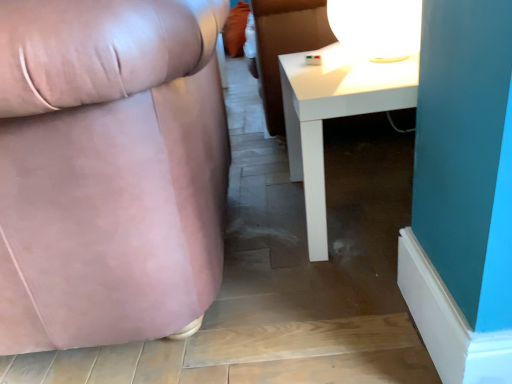
What do you see at coordinates (109, 170) in the screenshot? The image size is (512, 384). I see `matte pink fabric chair at left` at bounding box center [109, 170].

You are a GUI agent. You are given a task and a screenshot of the screen. Output one action in this format:
    pyautogui.click(x=<x>, y=<y>)
    Task: Click on the matte pink fabric chair at left
    The height and width of the screenshot is (384, 512).
    Given the screenshot: What is the action you would take?
    pyautogui.click(x=109, y=170)

How many degrees apart are the facing directions of matte pink fabric chair at left and white glossy table lamp at upper right?

The facing directions of matte pink fabric chair at left and white glossy table lamp at upper right are 88.9 degrees apart.

Would you say matte pink fabric chair at left is outside white glossy table lamp at upper right?

Yes, matte pink fabric chair at left is located beyond the bounds of white glossy table lamp at upper right.

Which is less distant, (196, 205) or (367, 50)?

Point (196, 205) is closer to the camera than point (367, 50).

Which object is more forward, matte pink fabric chair at left or white glossy table lamp at upper right?

Positioned in front is matte pink fabric chair at left.

From the picture: Is white glossy table at lower right wider than white glossy table lamp at upper right?

Indeed, white glossy table at lower right has a greater width compared to white glossy table lamp at upper right.

From the image's perspective, would you say white glossy table at lower right is shown under white glossy table lamp at upper right?

Yes.

From a real-world perspective, who is located higher, white glossy table at lower right or white glossy table lamp at upper right?

white glossy table lamp at upper right.

Is white glossy table lamp at upper right not close to matte pink fabric chair at left?

They are positioned close to each other.

From a real-world perspective, is white glossy table lamp at upper right on matte pink fabric chair at left?

Yes, from a real-world perspective, white glossy table lamp at upper right is above matte pink fabric chair at left.

Which of these two, white glossy table lamp at upper right or matte pink fabric chair at left, stands shorter?

Standing shorter between the two is white glossy table lamp at upper right.

Do you think white glossy table lamp at upper right is within matte pink fabric chair at left, or outside of it?

white glossy table lamp at upper right is spatially situated outside matte pink fabric chair at left.

What's the angular difference between matte pink fabric chair at left and white glossy table at lower right's facing directions?

The angular difference between matte pink fabric chair at left and white glossy table at lower right is 179 degrees.

Considering the relative sizes of matte pink fabric chair at left and white glossy table at lower right in the image provided, is matte pink fabric chair at left taller than white glossy table at lower right?

Correct, matte pink fabric chair at left is much taller as white glossy table at lower right.

Relative to white glossy table at lower right, is matte pink fabric chair at left in front or behind?

In the image, matte pink fabric chair at left appears in front of white glossy table at lower right.

Is matte pink fabric chair at left inside the boundaries of white glossy table at lower right, or outside?

matte pink fabric chair at left exists outside the volume of white glossy table at lower right.

From a real-world perspective, between white glossy table lamp at upper right and white glossy table at lower right, who is vertically higher?

In real-world perspective, white glossy table lamp at upper right is above.

Locate an element on the screen. This screenshot has height=384, width=512. table below the white glossy table lamp at upper right (from the image's perspective) is located at coordinates (334, 115).

Does white glossy table lamp at upper right appear on the right side of white glossy table at lower right?

No, white glossy table lamp at upper right is not to the right of white glossy table at lower right.

Does white glossy table at lower right have a greater height compared to matte pink fabric chair at left?

Incorrect, the height of white glossy table at lower right is not larger of that of matte pink fabric chair at left.

Is the depth of white glossy table at lower right greater than that of matte pink fabric chair at left?

That is True.

Considering the relative positions of white glossy table at lower right and matte pink fabric chair at left in the image provided, is white glossy table at lower right to the right of matte pink fabric chair at left from the viewer's perspective?

Yes, white glossy table at lower right is to the right of matte pink fabric chair at left.

At what (x,y) coordinates should I click in order to perform the action: click on chair on the left of white glossy table lamp at upper right. Please return your answer as a coordinate pair (x, y). Looking at the image, I should click on (109, 170).

Identify the location of table lamp located behind the white glossy table at lower right. (377, 27).

When comparing their distances from white glossy table lamp at upper right, does matte pink fabric chair at left or white glossy table at lower right seem further?

Among the two, matte pink fabric chair at left is located further to white glossy table lamp at upper right.

Looking at the image, which one is located further to white glossy table lamp at upper right, white glossy table at lower right or matte pink fabric chair at left?

The object further to white glossy table lamp at upper right is matte pink fabric chair at left.

Considering their positions, is matte pink fabric chair at left positioned further to white glossy table at lower right than white glossy table lamp at upper right?

matte pink fabric chair at left is further to white glossy table at lower right.

Looking at the image, which one is located further to white glossy table at lower right, white glossy table lamp at upper right or matte pink fabric chair at left?

matte pink fabric chair at left is further to white glossy table at lower right.

Based on their spatial positions, is white glossy table lamp at upper right or white glossy table at lower right closer to matte pink fabric chair at left?

white glossy table at lower right is closer to matte pink fabric chair at left.

Estimate the real-world distances between objects in this image. Which object is closer to matte pink fabric chair at left, white glossy table at lower right or white glossy table lamp at upper right?

white glossy table at lower right is positioned closer to the anchor matte pink fabric chair at left.

The height and width of the screenshot is (384, 512). Identify the location of table lamp between matte pink fabric chair at left and white glossy table at lower right. (377, 27).